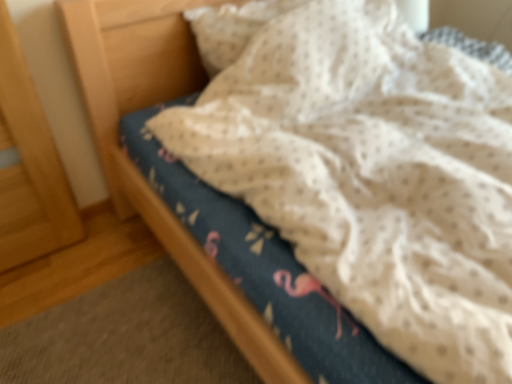
The width and height of the screenshot is (512, 384). What do you see at coordinates (231, 29) in the screenshot?
I see `white dotted fabric pillow at upper center` at bounding box center [231, 29].

Image resolution: width=512 pixels, height=384 pixels. In order to click on white dotted fabric pillow at upper center in this screenshot , I will do `click(231, 29)`.

Locate an element on the screen. The image size is (512, 384). white dotted fabric pillow at upper center is located at coordinates (231, 29).